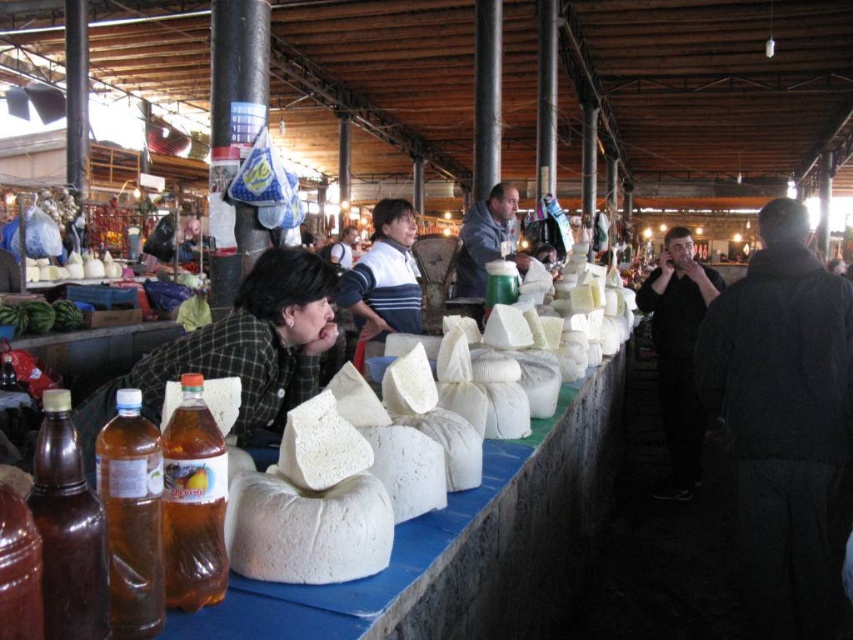
Does white soft cheese at center have a greater height compared to translucent plastic bottle at center?

Indeed, white soft cheese at center has a greater height compared to translucent plastic bottle at center.

Describe the element at coordinates (332, 492) in the screenshot. I see `white soft cheese at center` at that location.

The image size is (853, 640). I want to click on white soft cheese at center, so click(332, 492).

Is point (479, 454) in front of point (195, 348)?

Yes.

Looking at this image, can you confirm if white soft cheese at center is smaller than green plaid shirt at center?

Yes.

Locate an element on the screen. white soft cheese at center is located at coordinates (332, 492).

Consider the image. Does brown glass bottle at left have a smaller size compared to translucent plastic bottle at center?

No.

Does brown glass bottle at left have a lesser width compared to translucent plastic bottle at center?

Yes.

Is point (53, 484) behind point (223, 499)?

No, (53, 484) is in front of (223, 499).

Where is `brown glass bottle at left`? This screenshot has width=853, height=640. brown glass bottle at left is located at coordinates (68, 529).